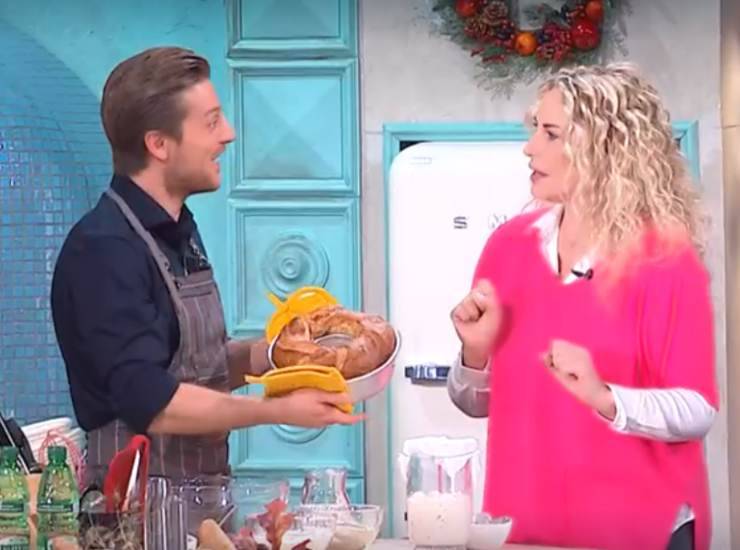
This screenshot has height=550, width=740. I want to click on potholders, so click(302, 379), click(291, 306).